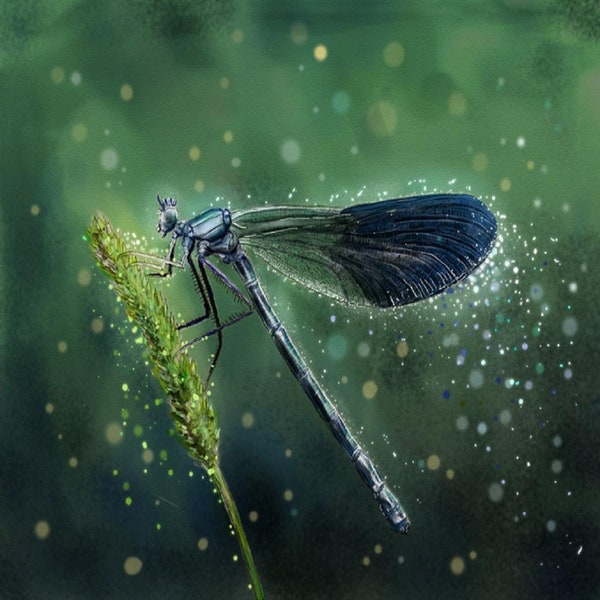
The height and width of the screenshot is (600, 600). In order to click on right front leg in this screenshot , I will do `click(184, 258)`.